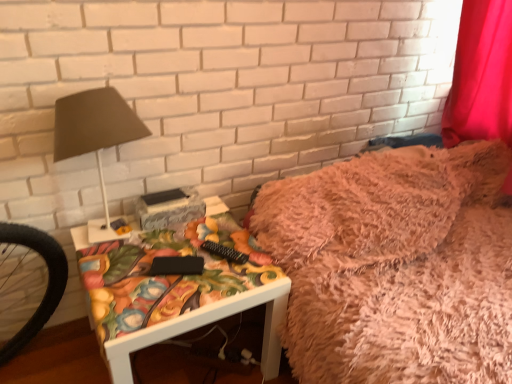
Locate an element on the screen. vacant region under matte brown lampshade at left (from a real-world perspective) is located at coordinates (112, 241).